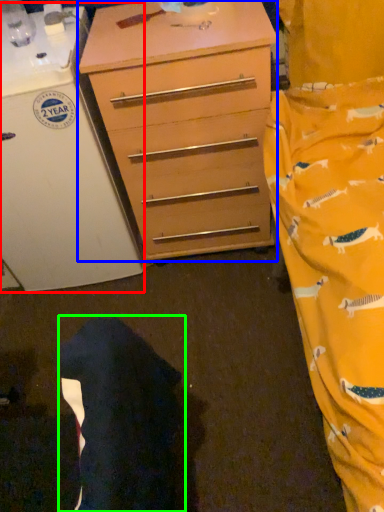
Question: Which object is the farthest from appliance (highlighted by a red box)? Choose among these: chest of drawers (highlighted by a blue box) or robe (highlighted by a green box).

Choices:
 (A) chest of drawers
 (B) robe

Answer: (B)